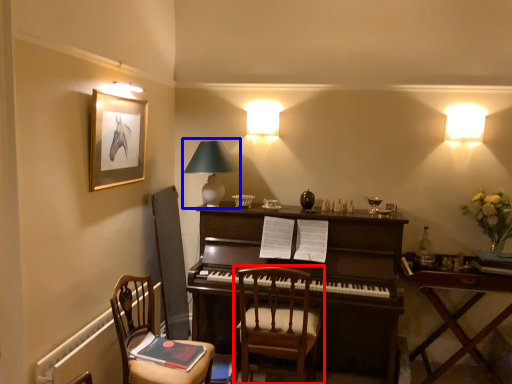
Question: Which point is closer to the camera, chair (highlighted by a red box) or table lamp (highlighted by a blue box)?

Choices:
 (A) chair
 (B) table lamp

Answer: (A)